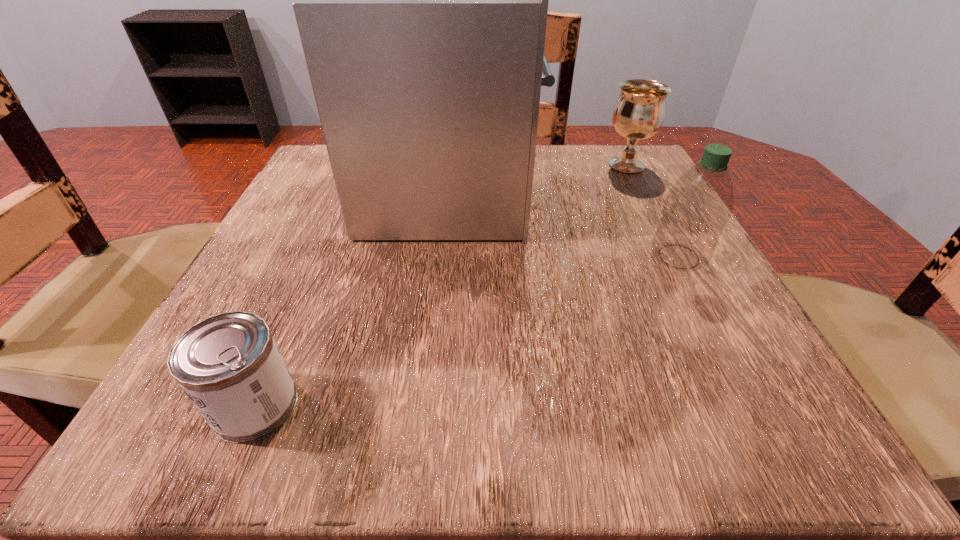
At what (x,y) coordinates should I click in order to perform the action: click on vacant space that's between the chalice and the tallest object. Please return your answer as a coordinate pair (x, y). Image resolution: width=960 pixels, height=540 pixels. Looking at the image, I should click on (539, 177).

Locate an element on the screen. The height and width of the screenshot is (540, 960). free space between the toaster oven and the chalice is located at coordinates (539, 177).

Where is `vacant space in between the chalice and the water bottle`? This screenshot has height=540, width=960. vacant space in between the chalice and the water bottle is located at coordinates (653, 211).

I want to click on empty space that is in between the nearest object and the chalice, so click(441, 286).

Locate an element on the screen. The width and height of the screenshot is (960, 540). unoccupied position between the shortest object and the toaster oven is located at coordinates (353, 296).

You are a GUI agent. You are given a task and a screenshot of the screen. Output one action in this format:
    pyautogui.click(x=<x>, y=<y>)
    Task: Click on the object that stands as the second closest to the water bottle
    
    Given the screenshot: What is the action you would take?
    pyautogui.click(x=638, y=114)

Locate an element on the screen. The image size is (960, 540). object that is the second closest to the toaster oven is located at coordinates (697, 207).

Where is `vacant space that satisfies the following two spatial constraints: 1. on the front side of the chalice; 2. on the right side of the water bottle`? This screenshot has width=960, height=540. vacant space that satisfies the following two spatial constraints: 1. on the front side of the chalice; 2. on the right side of the water bottle is located at coordinates (673, 256).

Identify the location of vacant space that satisfies the following two spatial constraints: 1. on the back side of the chalice; 2. on the right side of the shortest object. (358, 165).

Locate an element on the screen. This screenshot has height=540, width=960. vacant region that satisfies the following two spatial constraints: 1. on the front panel of the toaster oven; 2. on the left side of the water bottle is located at coordinates (444, 256).